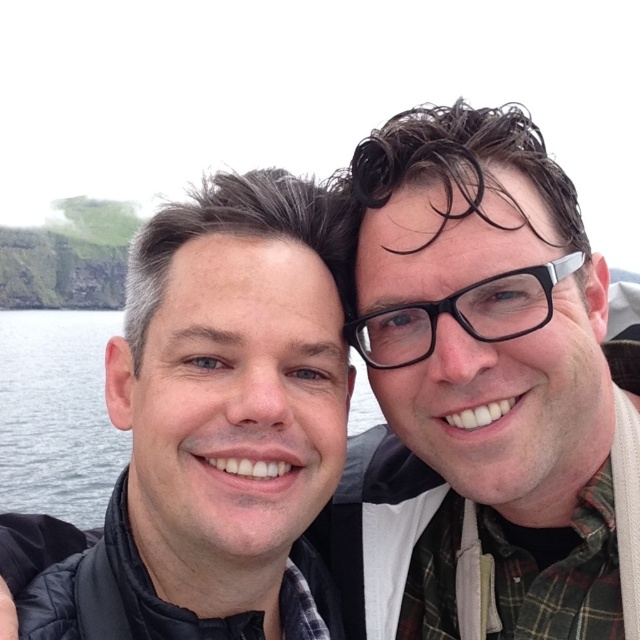
You are a photographer trying to capture a clear shot of both the matte black jacket at left and the black plastic glasses at right. Since you want to ensure both items are in focus, you need to know which one is wider. Which object has a greater width?

The matte black jacket at left has a greater width than the black plastic glasses at right, as the matte black jacket at left surpasses the black plastic glasses at right in width.

You are a photographer trying to adjust the lighting for a portrait. You notice the matte black jacket at left and the black plastic glasses at right. Which object is closer to the bottom of the image?

The matte black jacket at left is positioned under the black plastic glasses at right, so it is closer to the bottom of the image.

You are a photographer trying to capture a group photo of the two people in the scene. The minimum focus distance for your camera is 6 feet. Can you take a photo of both the matte black jacket at left and the black plastic glasses at right in focus without adjusting your camera settings?

A: The matte black jacket at left and the black plastic glasses at right are 6.02 feet apart. Since the minimum focus distance is 6 feet, the camera can focus on both objects as they are just over the required distance apart.